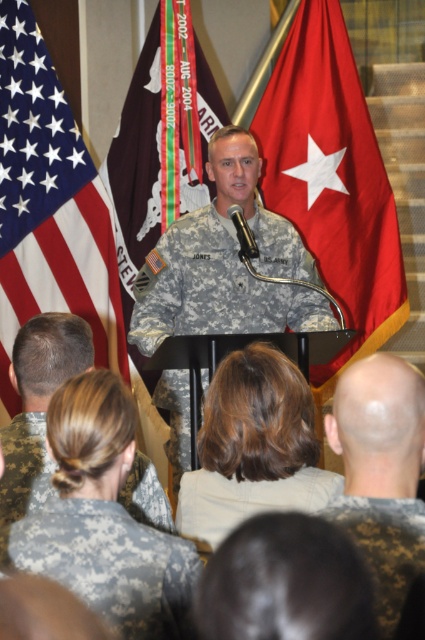
The width and height of the screenshot is (425, 640). Describe the element at coordinates (382, 474) in the screenshot. I see `bald head at center` at that location.

Does bald head at center appear over camouflage uniform at center?

No, bald head at center is not above camouflage uniform at center.

Find the location of `bald head at center`. bald head at center is located at coordinates (382, 474).

Is red fabric flag at center to the right of digital camouflage uniform at lower left from the viewer's perspective?

Correct, you'll find red fabric flag at center to the right of digital camouflage uniform at lower left.

Consider the image. Which of these two, red fabric flag at center or digital camouflage uniform at lower left, stands shorter?

digital camouflage uniform at lower left

Does point (325, 22) lie in front of point (62, 556)?

No.

Find the location of a particular element. The height and width of the screenshot is (640, 425). red fabric flag at center is located at coordinates (333, 179).

Who is shorter, american flag at upper left or camouflage fabric uniform at center?

camouflage fabric uniform at center

Can you confirm if american flag at upper left is wider than camouflage fabric uniform at center?

No, american flag at upper left is not wider than camouflage fabric uniform at center.

Is point (56, 83) farther from camera compared to point (223, 266)?

That is True.

Where is `american flag at upper left`? The image size is (425, 640). american flag at upper left is located at coordinates (48, 205).